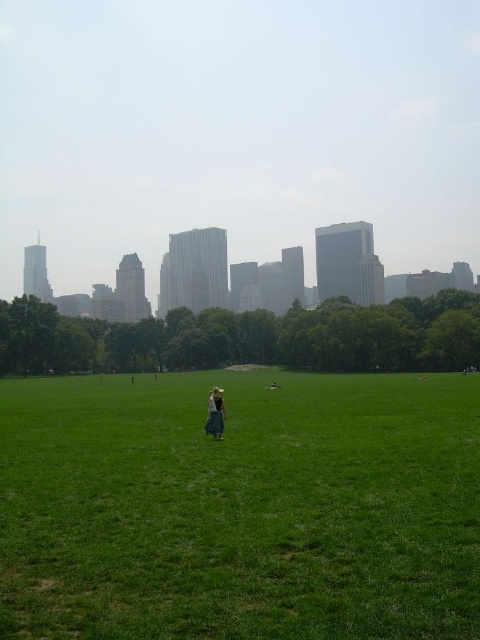
Between green grass at center and light brown fabric dress at center, which one has more height?

With more height is green grass at center.

Can you confirm if green grass at center is positioned to the right of light brown fabric dress at center?

Incorrect, green grass at center is not on the right side of light brown fabric dress at center.

Identify the location of green grass at center. This screenshot has width=480, height=640. (240, 508).

Identify the location of green grass at center. (240, 508).